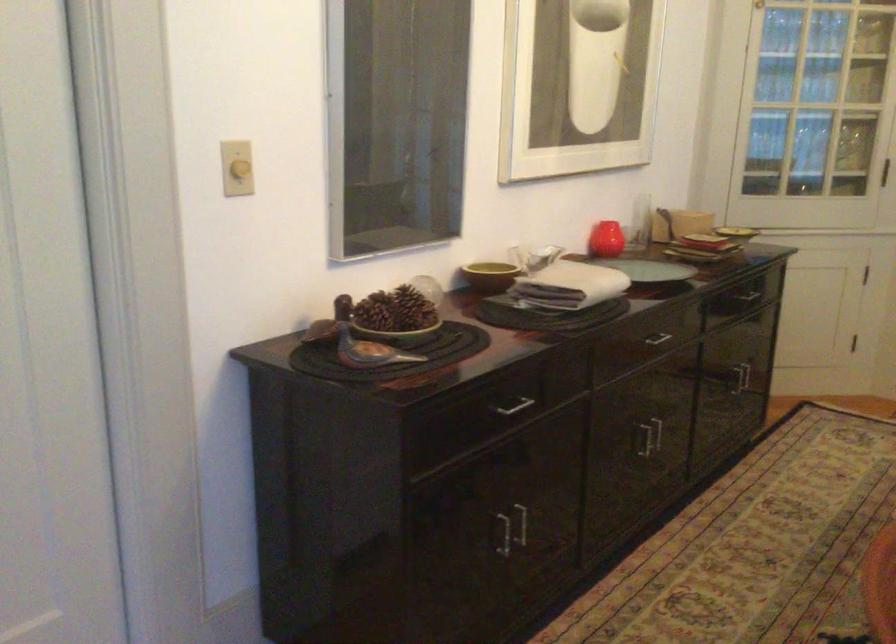
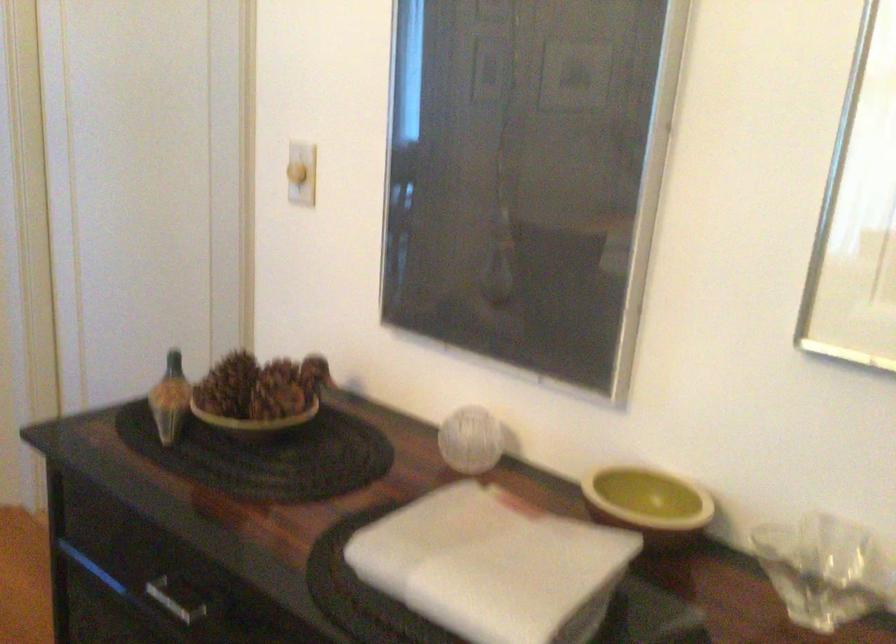
Find the pixel in the second image that matches [446,294] in the first image.

(470, 440)